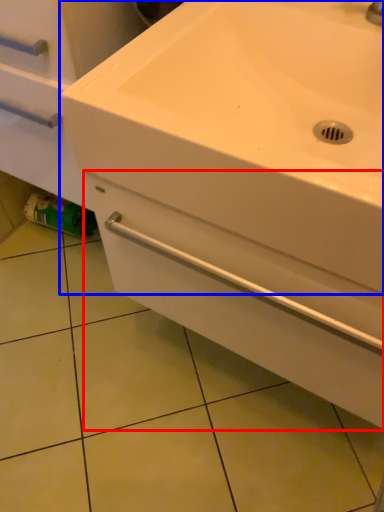
Question: Which of the following is the farthest to the observer, drawer (highlighted by a red box) or sink (highlighted by a blue box)?

Choices:
 (A) drawer
 (B) sink

Answer: (A)